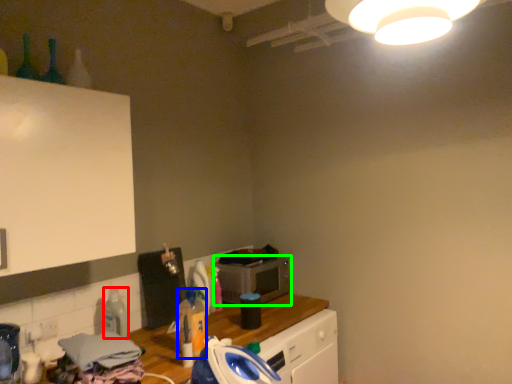
Question: Based on their relative distances, which object is farther from bottle (highlighted by a red box)? Choose from bottle (highlighted by a blue box) and microwave oven (highlighted by a green box).

Choices:
 (A) bottle
 (B) microwave oven

Answer: (B)